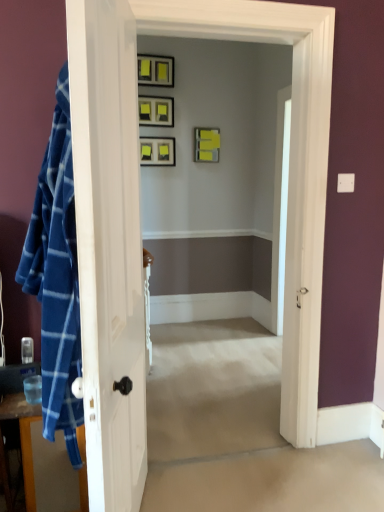
Question: Is the position of matte black picture frame at upper center, marked as the 4th picture frame in a bottom-to-top arrangement, less distant than that of blue plaid fabric at left?

Choices:
 (A) yes
 (B) no

Answer: (B)

Question: Would you say matte black picture frame at upper center, which appears as the first picture frame when viewed from the top, is outside blue plaid fabric at left?

Choices:
 (A) yes
 (B) no

Answer: (A)

Question: Is matte black picture frame at upper center, which appears as the first picture frame when viewed from the top, touching blue plaid fabric at left?

Choices:
 (A) yes
 (B) no

Answer: (B)

Question: Is matte black picture frame at upper center, marked as the 4th picture frame in a bottom-to-top arrangement, smaller than blue plaid fabric at left?

Choices:
 (A) yes
 (B) no

Answer: (A)

Question: From a real-world perspective, is matte black picture frame at upper center, marked as the 4th picture frame in a bottom-to-top arrangement, below blue plaid fabric at left?

Choices:
 (A) yes
 (B) no

Answer: (B)

Question: Is yellow matte picture frame at upper center, the second picture frame from the bottom, outside matte black picture frame at upper center, the third picture frame positioned from the bottom?

Choices:
 (A) yes
 (B) no

Answer: (A)

Question: Does yellow matte picture frame at upper center, the second picture frame from the bottom, lie behind matte black picture frame at upper center, the third picture frame positioned from the bottom?

Choices:
 (A) no
 (B) yes

Answer: (B)

Question: Is yellow matte picture frame at upper center, the second picture frame from the bottom, far away from matte black picture frame at upper center, arranged as the second picture frame when viewed from the top?

Choices:
 (A) no
 (B) yes

Answer: (A)

Question: Can you confirm if yellow matte picture frame at upper center, the 3th picture frame in the top-to-bottom sequence, is smaller than matte black picture frame at upper center, the third picture frame positioned from the bottom?

Choices:
 (A) yes
 (B) no

Answer: (B)

Question: Does yellow matte picture frame at upper center, the 3th picture frame in the top-to-bottom sequence, touch matte black picture frame at upper center, the third picture frame positioned from the bottom?

Choices:
 (A) no
 (B) yes

Answer: (A)

Question: Can matte black picture frame at upper center, arranged as the second picture frame when viewed from the top, be found inside yellow matte picture frame at upper center, the 3th picture frame in the top-to-bottom sequence?

Choices:
 (A) no
 (B) yes

Answer: (A)

Question: Does matte black picture frame at upper center, the third picture frame positioned from the bottom, have a lesser width compared to blue plaid fabric at left?

Choices:
 (A) yes
 (B) no

Answer: (A)